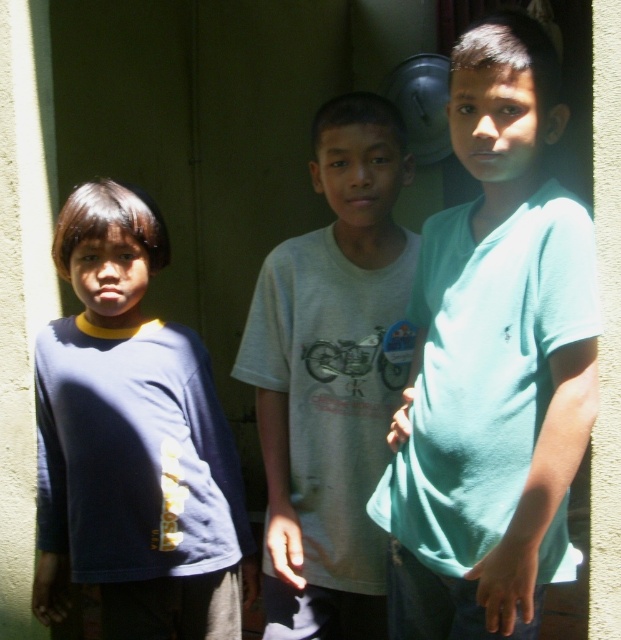
You are a photographer trying to capture a clear shot of both the teal matte shirt at center and the white cotton shirt at center. Which shirt should you focus on first to ensure both are in focus?

The teal matte shirt at center is closer to the viewer than the white cotton shirt at center. To ensure both are in focus, focus on the teal matte shirt at center first, as it is closer, and adjust the camera settings to include the white cotton shirt at center in the depth of field.